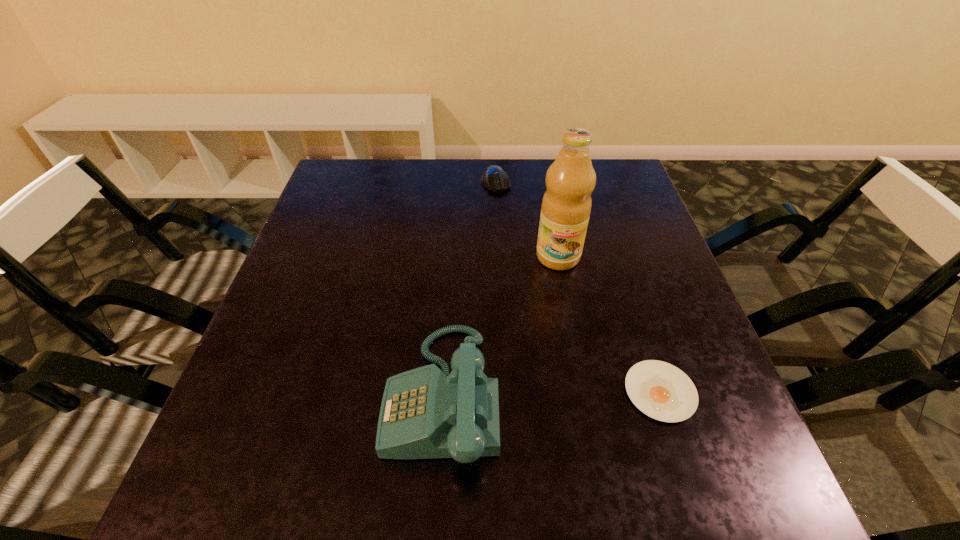
This screenshot has width=960, height=540. Find the location of `the second tallest object`. the second tallest object is located at coordinates (425, 413).

Where is `the shortest object`? the shortest object is located at coordinates (660, 390).

Locate an element on the screen. egg yolk is located at coordinates (660, 390).

Locate an element on the screen. the second shortest object is located at coordinates (494, 178).

Where is `computer mouse`? This screenshot has width=960, height=540. computer mouse is located at coordinates (494, 178).

Where is `the second farthest object`? The image size is (960, 540). the second farthest object is located at coordinates (566, 205).

At what (x,y) coordinates should I click in order to perform the action: click on olive oil. Please return your answer as a coordinate pair (x, y). This screenshot has height=540, width=960. Looking at the image, I should click on (566, 205).

At what (x,y) coordinates should I click in order to perform the action: click on vacant space located on the dial of the second tallest object. Please return your answer as a coordinate pair (x, y). This screenshot has width=960, height=540. Looking at the image, I should click on (348, 395).

This screenshot has height=540, width=960. I want to click on vacant position located on the dial of the second tallest object, so point(243,395).

Identify the location of vacant space located 0.070m on the dial of the second tallest object. (348, 395).